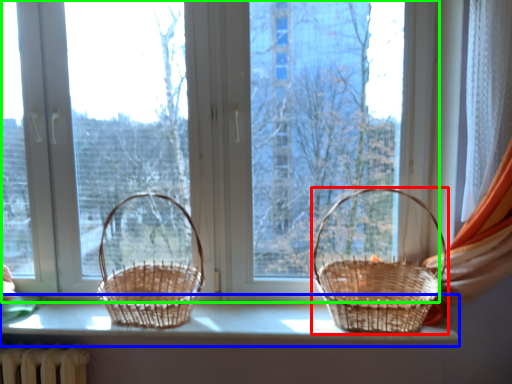
Question: Which object is the closest to the picnic basket (highlighted by a red box)? Choose among these: window sill (highlighted by a blue box) or window (highlighted by a green box).

Choices:
 (A) window sill
 (B) window

Answer: (A)